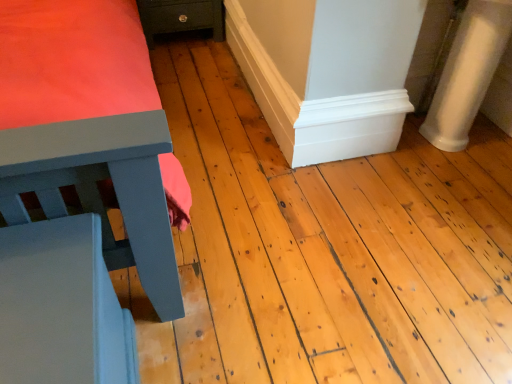
Where is `white smooth column at right`? Image resolution: width=512 pixels, height=384 pixels. white smooth column at right is located at coordinates (468, 73).

The height and width of the screenshot is (384, 512). What do you see at coordinates (468, 73) in the screenshot?
I see `white smooth column at right` at bounding box center [468, 73].

At what (x,y) coordinates should I click in order to perform the action: click on white smooth column at right. Please return your answer as a coordinate pair (x, y). Looking at the image, I should click on (468, 73).